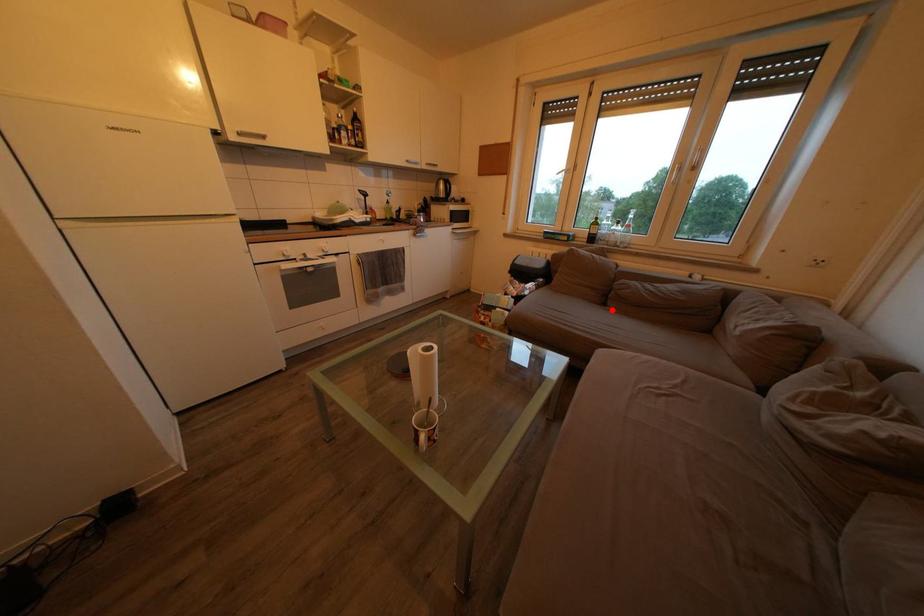
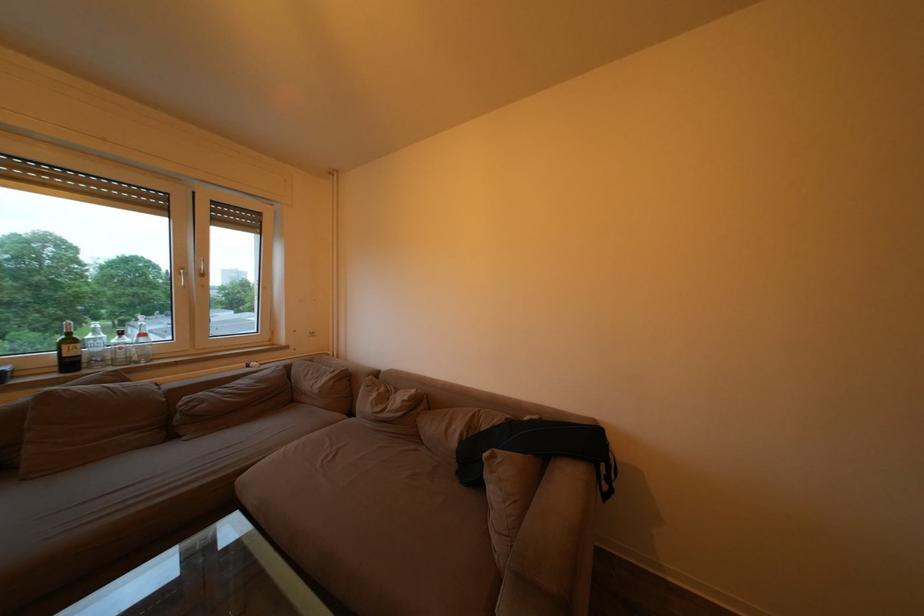
The point at the highlighted location is marked in the first image. Where is the corresponding point in the second image?

(178, 443)